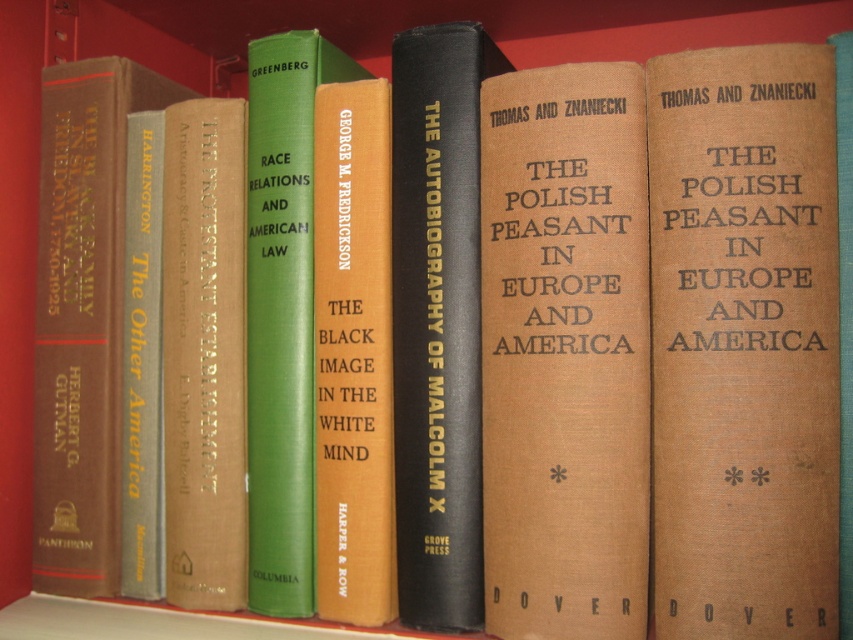
You are organizing books on a shelf and need to place a new book that is 6 inches wide. You see the brown cloth book at center and the green hardcover book at center. Is there enough space between them to fit the new book?

The distance between the brown cloth book at center and the green hardcover book at center is 7.47 inches. Since the new book is 6 inches wide, there is enough space between them to fit the new book.

Looking at this image, you are organizing a bookshelf and need to place a new book that is 4 inches wide between the green hardcover book at center and the matte gray book at center. Can the new book fit in the space between them?

The green hardcover book at center and the matte gray book at center are 4.55 inches apart from each other. Since the new book is 4 inches wide, it can fit in the space between them as 4 inches is less than 4.55 inches.

You are organizing books on a shelf and see the brown cloth book at center and the green hardcover book at center. Which book is located to the right of the other?

The brown cloth book at center is positioned on the right side of green hardcover book at center.